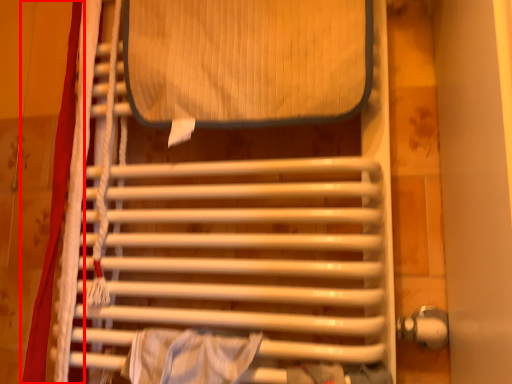
Question: In this image, where is curtain (annotated by the red box) located relative to furniture?

Choices:
 (A) left
 (B) right

Answer: (A)